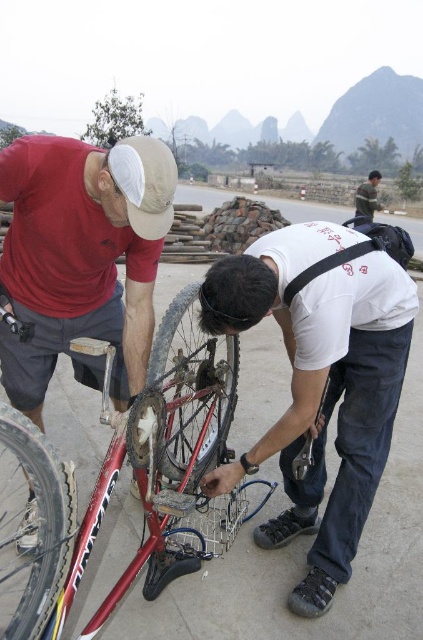
Between point (131, 234) and point (376, 204), which one is positioned behind?

Point (376, 204)

Is matte red bicycle at left taller than green striped sweater at upper right?

No.

The width and height of the screenshot is (423, 640). Describe the element at coordinates (80, 257) in the screenshot. I see `matte red bicycle at left` at that location.

Where is `matte red bicycle at left`? matte red bicycle at left is located at coordinates (80, 257).

Is shiny metallic bicycle wheel at center above shiny metallic bicycle wheel at lower left?

Yes.

What do you see at coordinates (192, 385) in the screenshot?
I see `shiny metallic bicycle wheel at center` at bounding box center [192, 385].

Who is more distant from viewer, (227, 362) or (49, 499)?

Positioned behind is point (227, 362).

The image size is (423, 640). In order to click on shiny metallic bicycle wheel at center in this screenshot , I will do `click(192, 385)`.

This screenshot has height=640, width=423. I want to click on white matte shirt at center, so click(x=320, y=381).

Is point (299, 525) positioned before point (55, 589)?

That is False.

Where is `white matte shirt at center`? white matte shirt at center is located at coordinates (320, 381).